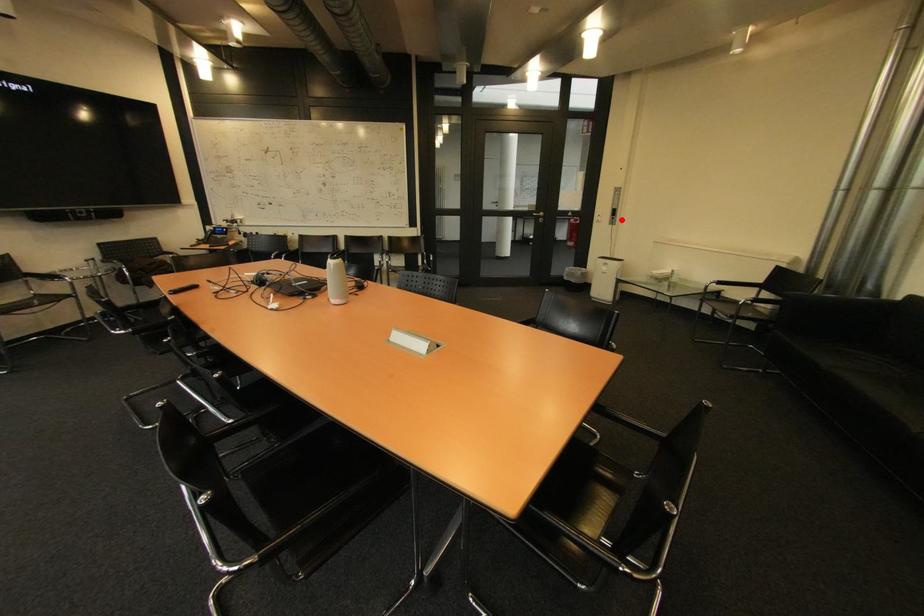
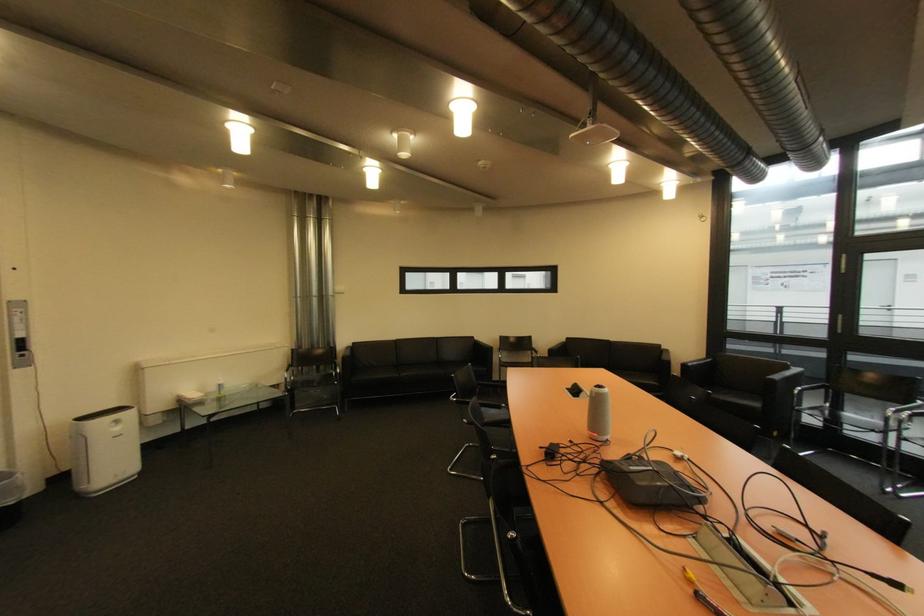
Find the pixel in the second image that matches the highlighted location in the first image.

(30, 357)